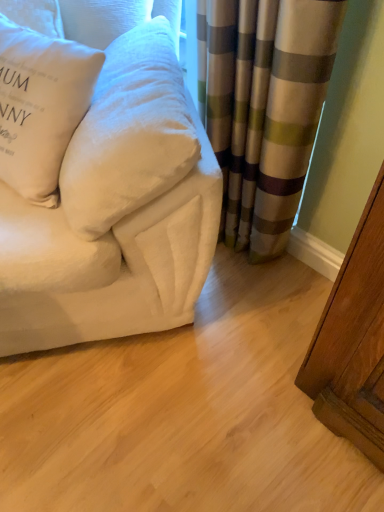
Locate an element on the screen. Image resolution: width=384 pixels, height=512 pixels. free space in front of striped fabric curtain at center is located at coordinates (233, 322).